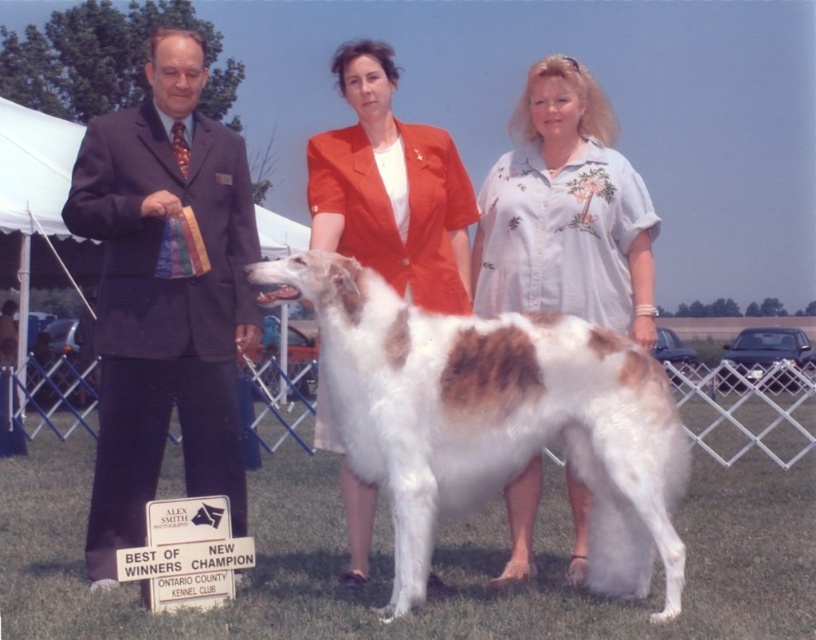
You are a photographer at the dog show and need to position yourself so that the white fur at center and the dark suit at left are both in frame. Based on their heights, which object should you adjust your camera angle to focus on first to ensure both are visible?

The white fur at center is shorter than the dark suit at left, so you should lower your camera angle slightly to ensure both the shorter white fur at center and the taller dark suit at left are visible in the frame.

You are a photographer at the dog show. You need to capture a photo where both the white fur at center and the matte orange blazer at center are visible. Based on their positions, which object should be placed to the left in the frame?

The matte orange blazer at center should be placed to the left in the frame because the white fur at center is positioned on the right side of it.

You are a photographer at the dog show and need to position your camera to capture the white fur at center. According to the coordinates provided, where exactly should you aim your camera?

The white fur at center is located at coordinates point (494, 419), so you should aim your camera at that exact point to capture it.